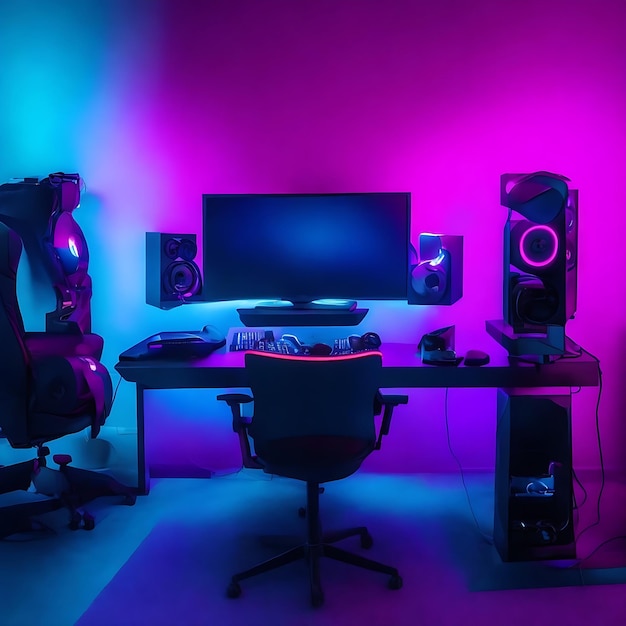
This screenshot has width=626, height=626. I want to click on carpet, so click(62, 568), click(187, 568), click(583, 595).